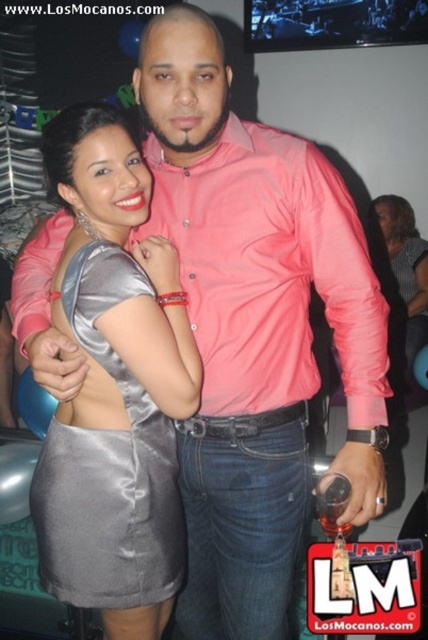
Based on the photo, does satin gray dress at center have a greater width compared to satin dress at center?

Yes.

Can you confirm if satin gray dress at center is positioned above satin dress at center?

Actually, satin gray dress at center is below satin dress at center.

Is point (158, 600) positioned after point (374, 198)?

No, (158, 600) is closer to viewer.

Find the location of `satin gray dress at center`. satin gray dress at center is located at coordinates (107, 467).